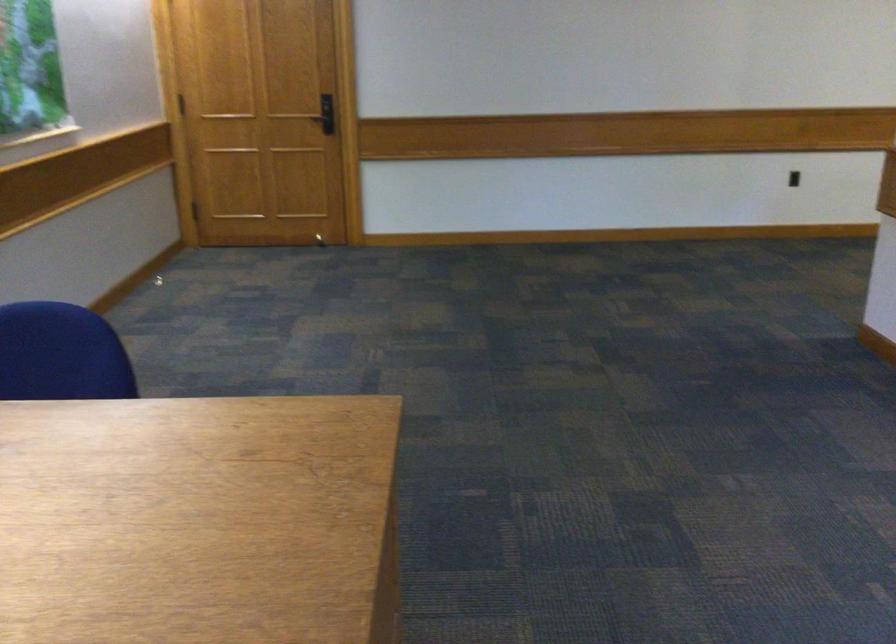
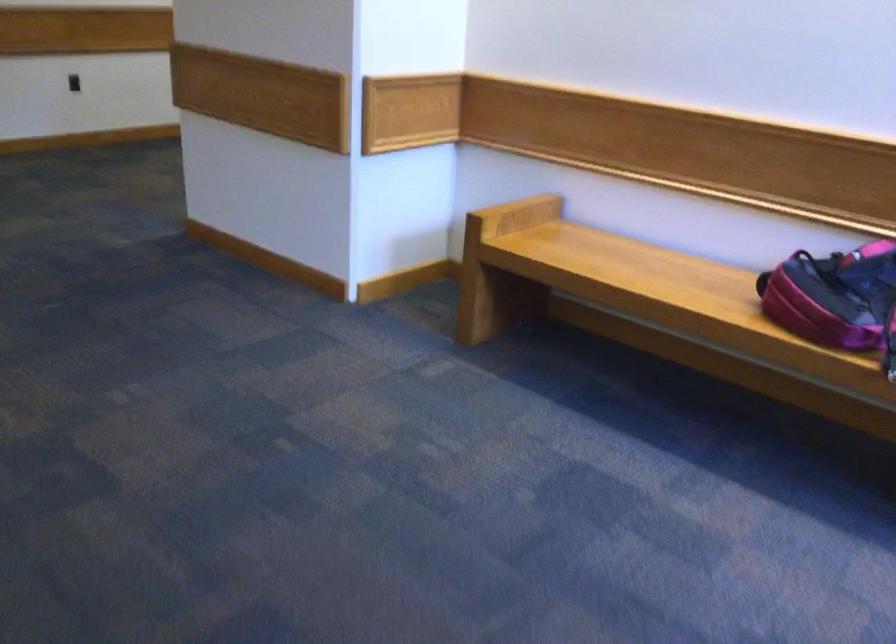
Question: How did the camera likely rotate?

Choices:
 (A) Left
 (B) Right
 (C) Up
 (D) Down

Answer: (B)